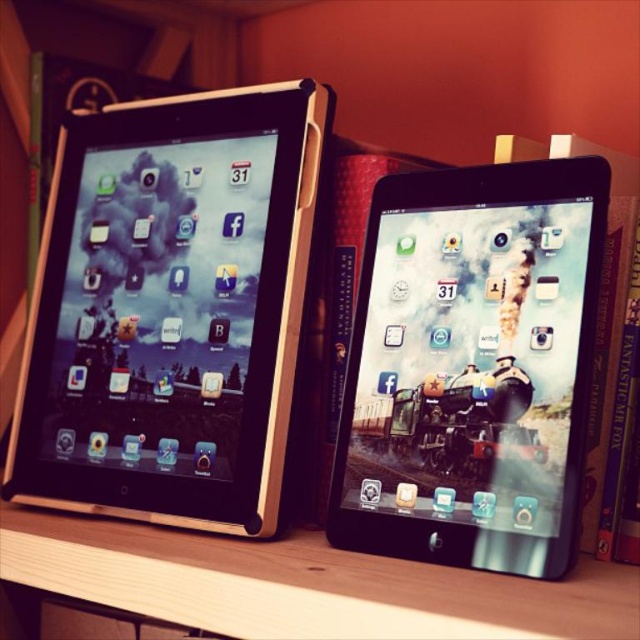
You are a delivery person who needs to place a 12 inch wide package between the two points marked as point (x=168, y=412). Will the package fit without overlapping either point?

The two points are 27.82 inches apart, so the 12 inch wide package will fit between them without overlapping either point since 12 is less than 27.82.

You are organizing a display of two tablets on a shelf. The scene shows a matte black tablet at left and a satin black tablet at center. Which tablet should you place on the left side of the shelf to match the scene?

The matte black tablet at left should be placed on the left side of the shelf since it is already positioned to the left of the satin black tablet at center in the scene.

You are setting up a display on a narrow shelf. You have two tablets, the matte black tablet at left and the satin black tablet at center. Which one should you choose if you want the wider tablet for the display?

The matte black tablet at left is wider than the satin black tablet at center, so you should choose the matte black tablet at left for the display.